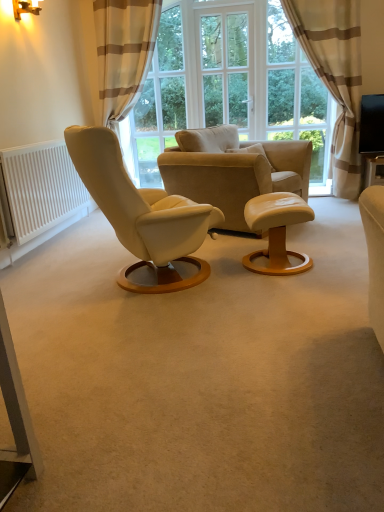
I want to click on vacant space positioned to the left of matte white stool at center, so click(x=225, y=275).